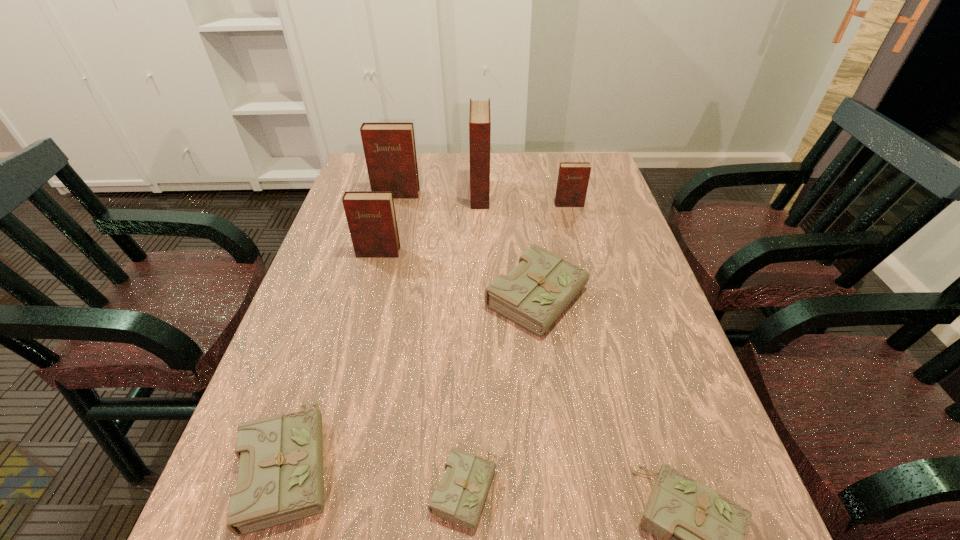
Identify which green diary is located as the second nearest to the fourth tallest object. Please provide its 2D coordinates. Your answer should be formatted as a tuple, i.e. [(x, y)], where the tuple contains the x and y coordinates of a point satisfying the conditions above.

[(460, 497)]

Find the location of a particular element. Image resolution: width=960 pixels, height=540 pixels. vacant space that satisfies the following two spatial constraints: 1. on the front cover of the biggest green diary; 2. on the left side of the second tallest diary is located at coordinates pyautogui.click(x=370, y=298).

The height and width of the screenshot is (540, 960). I want to click on free space that satisfies the following two spatial constraints: 1. on the back side of the fourth nearest object; 2. on the front cover of the tallest object, so click(x=526, y=194).